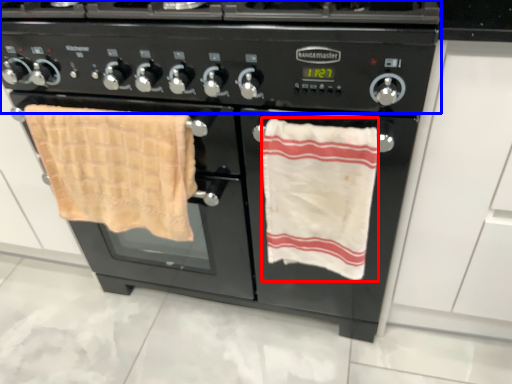
Question: Which object is further to the camera taking this photo, beach towel (highlighted by a red box) or gas stove (highlighted by a blue box)?

Choices:
 (A) beach towel
 (B) gas stove

Answer: (A)